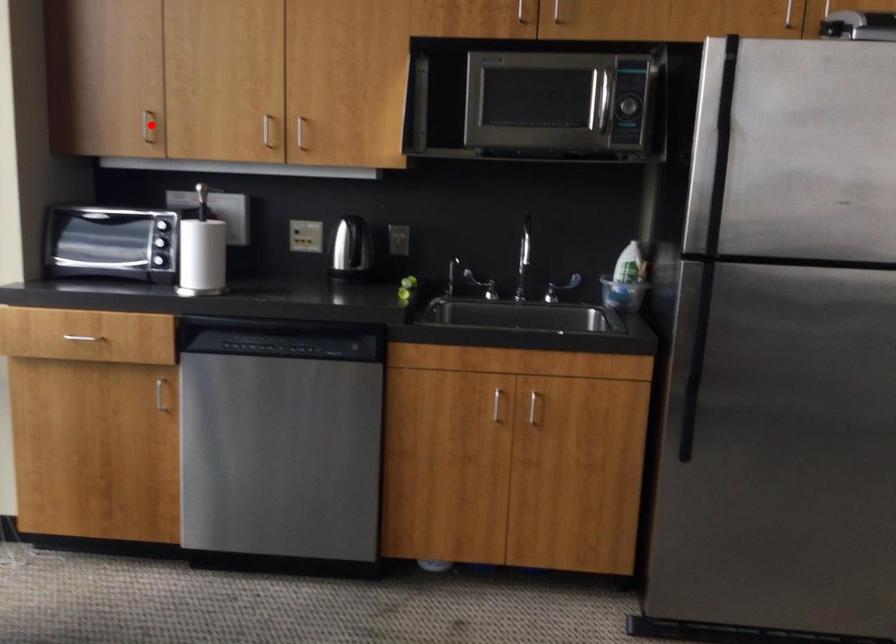
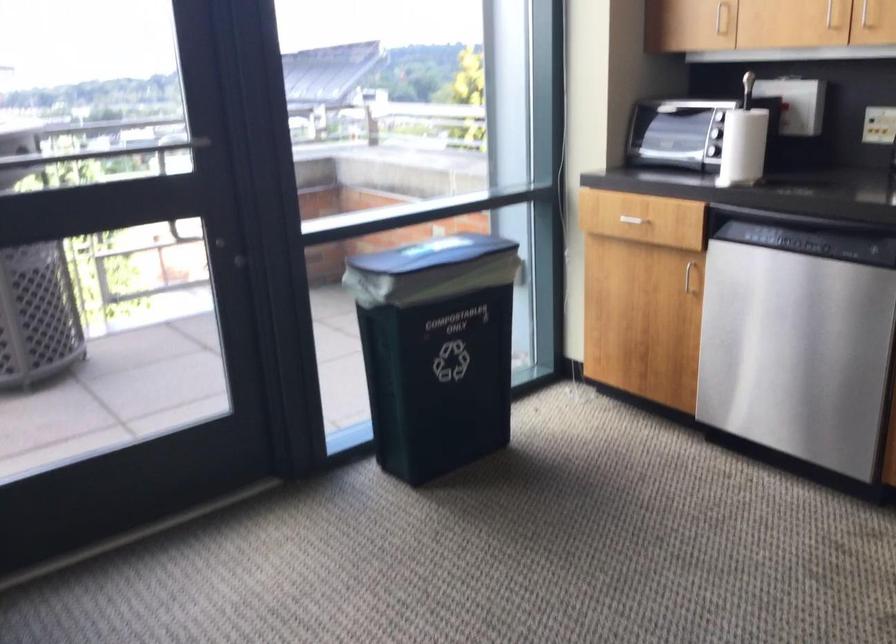
Where in the second image is the point corresponding to the highlighted location from the first image?

(721, 17)